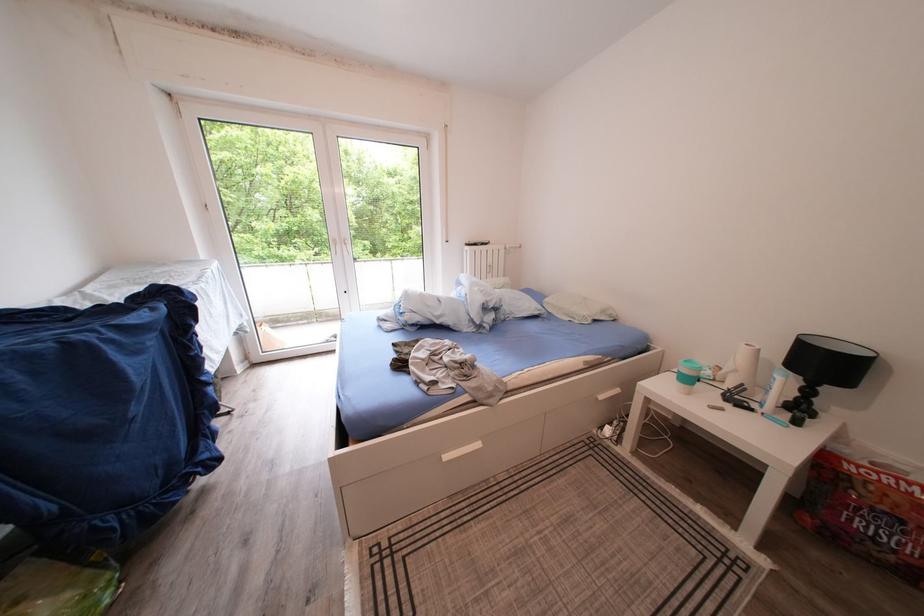
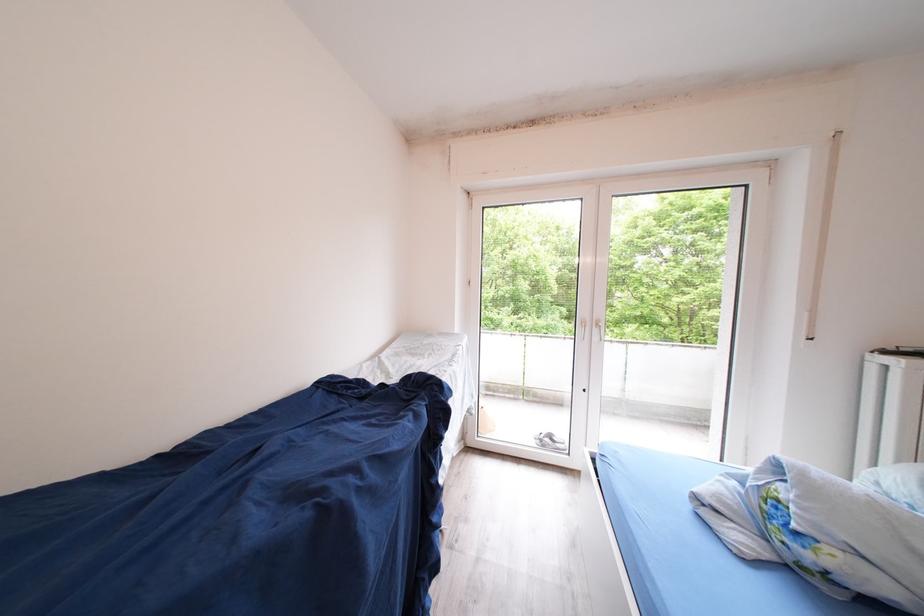
Question: The first image is from the beginning of the video and the second image is from the end. How did the camera likely rotate when shooting the video?

Choices:
 (A) Left
 (B) Right
 (C) Up
 (D) Down

Answer: (A)